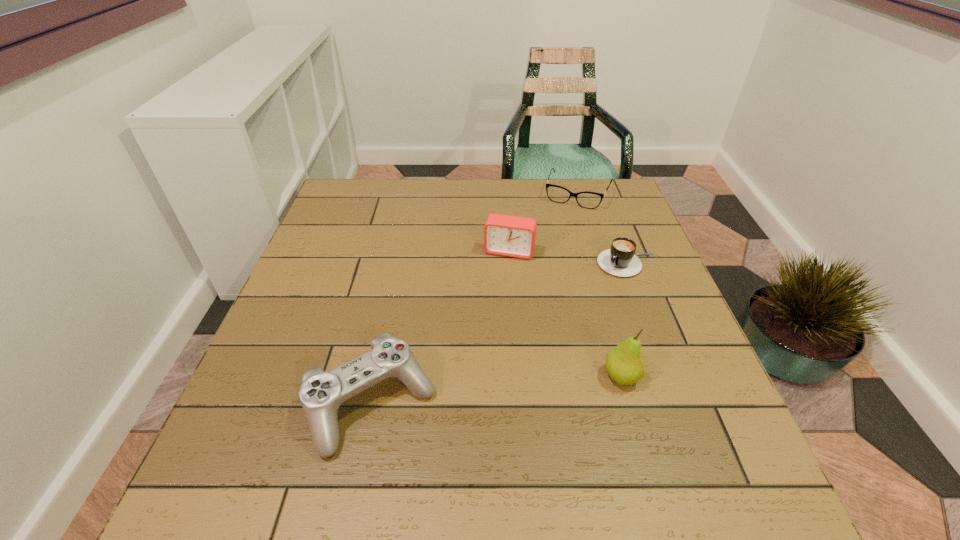
You are a GUI agent. You are given a task and a screenshot of the screen. Output one action in this format:
    pyautogui.click(x=<x>, y=<y>)
    Task: Click on the pear situated at the right edge
    
    Given the screenshot: What is the action you would take?
    pyautogui.click(x=624, y=364)

I want to click on spectacles present at the right edge, so click(x=590, y=200).

Identify the location of cappuccino that is at the right edge. This screenshot has height=540, width=960. (619, 260).

The width and height of the screenshot is (960, 540). Identify the location of object that is at the near left corner. (321, 394).

This screenshot has width=960, height=540. What are the coordinates of `object at the far right corner` in the screenshot? It's located at (590, 200).

Image resolution: width=960 pixels, height=540 pixels. I want to click on free location at the far edge, so click(x=572, y=214).

In the image, there is a desktop. In order to click on vacant space at the near edge in this screenshot , I will do `click(351, 417)`.

Locate an element on the screen. Image resolution: width=960 pixels, height=540 pixels. vacant space at the left edge of the desktop is located at coordinates (319, 239).

This screenshot has width=960, height=540. In the image, there is a desktop. In order to click on free space at the right edge in this screenshot , I will do `click(601, 223)`.

This screenshot has height=540, width=960. Find the location of `free region at the far left corner`. free region at the far left corner is located at coordinates (377, 197).